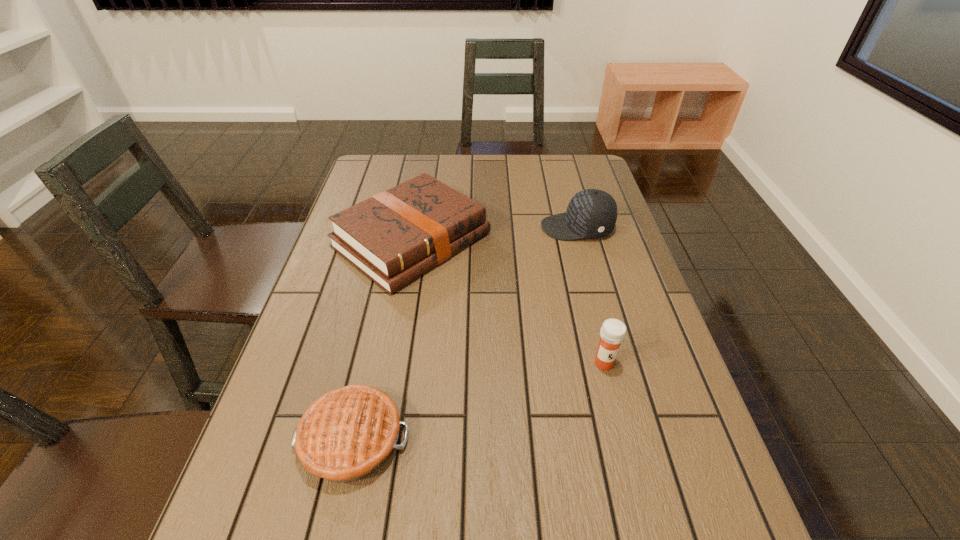
At what (x,y) coordinates should I click in order to perform the action: click on object that stands as the third closest to the second shortest object. Please return your answer as a coordinate pair (x, y). The image size is (960, 540). Looking at the image, I should click on (348, 433).

Locate which object is the third closest to the medicine. Please provide its 2D coordinates. Your answer should be formatted as a tuple, i.e. [(x, y)], where the tuple contains the x and y coordinates of a point satisfying the conditions above.

[(592, 213)]

The height and width of the screenshot is (540, 960). Find the location of `vacant space that satisfies the following two spatial constraints: 1. at the front of the baseball cap where the brim is located; 2. on the front side of the hardback book`. vacant space that satisfies the following two spatial constraints: 1. at the front of the baseball cap where the brim is located; 2. on the front side of the hardback book is located at coordinates (581, 240).

The width and height of the screenshot is (960, 540). I want to click on vacant area that satisfies the following two spatial constraints: 1. at the front of the baseball cap where the brim is located; 2. on the label side of the second nearest object, so click(x=613, y=363).